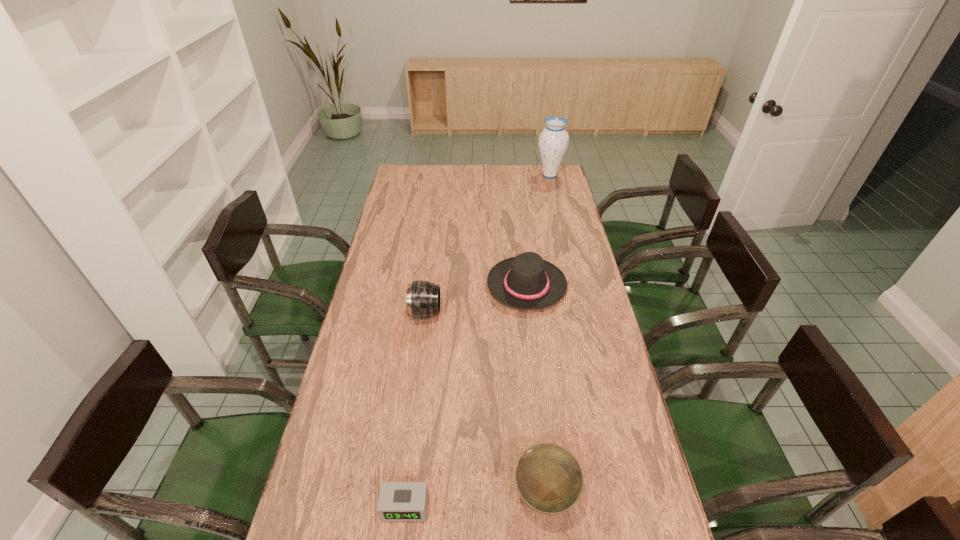
Find the location of a particular element. vase is located at coordinates (553, 141).

This screenshot has width=960, height=540. I want to click on the farthest object, so point(553,141).

Locate an element on the screen. The height and width of the screenshot is (540, 960). the second tallest object is located at coordinates (422, 299).

Locate an element on the screen. dress hat is located at coordinates (527, 282).

I want to click on bowl, so click(549, 478).

In order to click on alarm clock in this screenshot , I will do `click(398, 501)`.

Find the location of a particular element. This screenshot has height=540, width=960. free space located on the left of the vase is located at coordinates (457, 176).

This screenshot has height=540, width=960. In order to click on vacant region located at the front element of the fourth shortest object in this screenshot , I will do (500, 314).

Locate an element on the screen. vacant space located on the left of the dress hat is located at coordinates point(430,286).

This screenshot has height=540, width=960. I want to click on free space located 0.270m on the back of the bowl, so click(x=533, y=375).